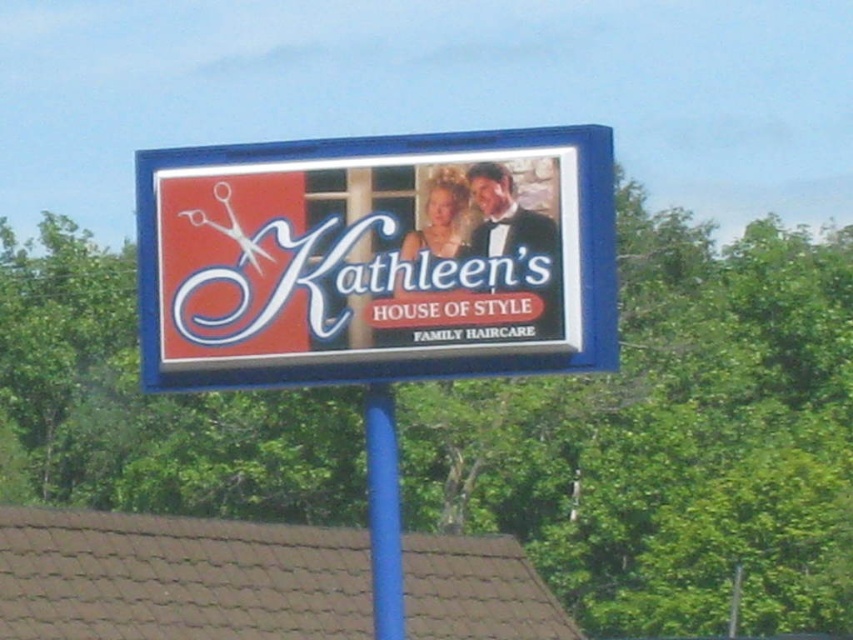
Question: Is matte white signboard at center to the right of blue plastic pole at center from the viewer's perspective?

Choices:
 (A) yes
 (B) no

Answer: (A)

Question: Which point is farther to the camera?

Choices:
 (A) (270, 326)
 (B) (140, 205)
 (C) (387, 513)

Answer: (B)

Question: Estimate the real-world distances between objects in this image. Which object is farther from the blue plastic pole at center?

Choices:
 (A) matte white signboard at center
 (B) matte plastic sign at center

Answer: (B)

Question: Does matte white signboard at center appear under blue plastic pole at center?

Choices:
 (A) yes
 (B) no

Answer: (B)

Question: Estimate the real-world distances between objects in this image. Which object is farther from the matte plastic sign at center?

Choices:
 (A) matte white signboard at center
 (B) blue plastic pole at center

Answer: (B)

Question: Where is matte white signboard at center located in relation to blue plastic pole at center in the image?

Choices:
 (A) right
 (B) left

Answer: (A)